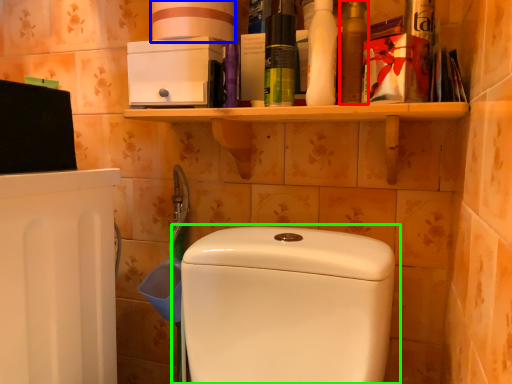
Question: Estimate the real-world distances between objects in this image. Which object is farther from mouthwash (highlighted by a red box), toilet paper (highlighted by a blue box) or toilet (highlighted by a green box)?

Choices:
 (A) toilet paper
 (B) toilet

Answer: (B)